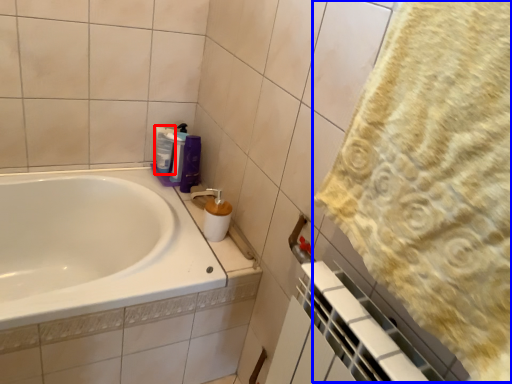
Question: Which of the following is the closest to the observer, cleaning product (highlighted by a red box) or bath towel (highlighted by a blue box)?

Choices:
 (A) cleaning product
 (B) bath towel

Answer: (B)